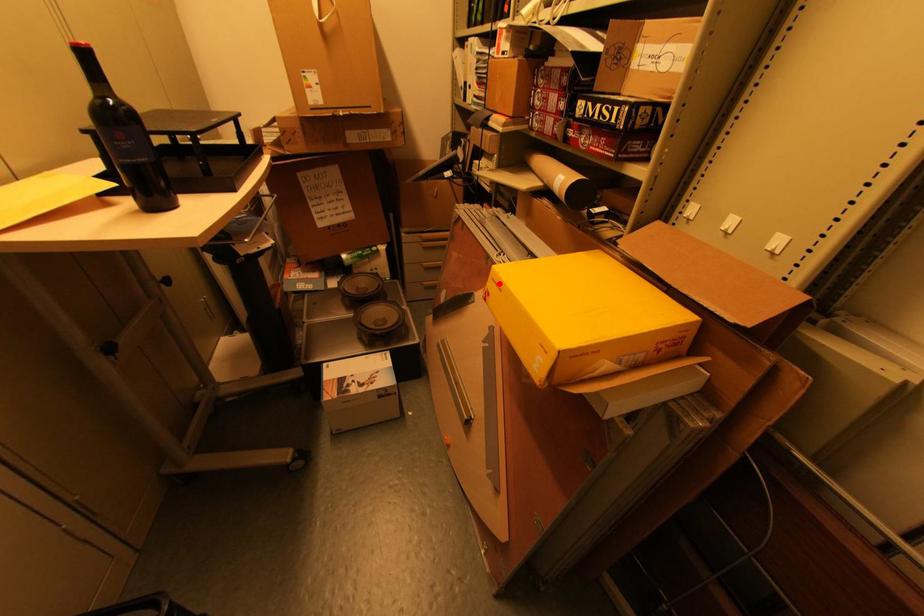
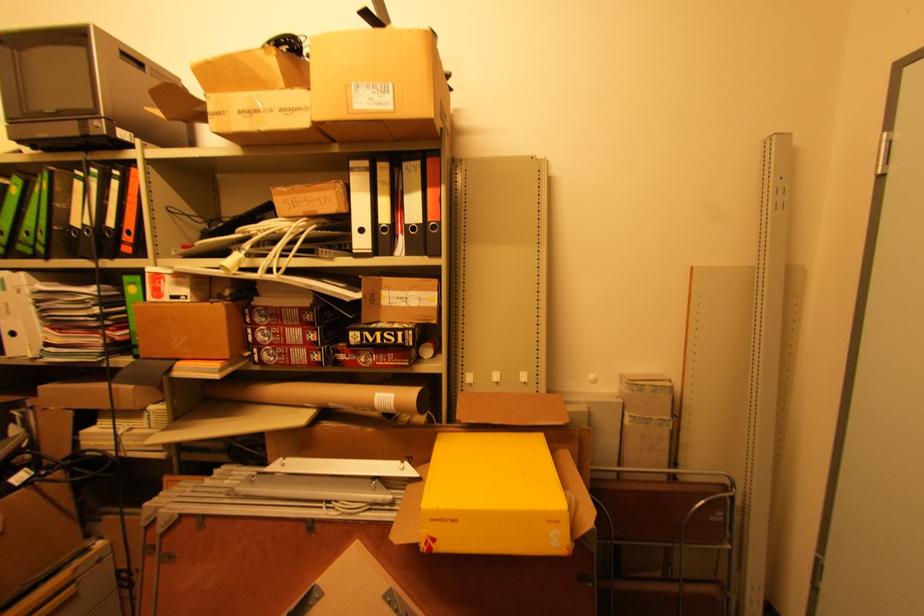
Find the pixel in the second image that matches the highlighted location in the first image.

(444, 521)